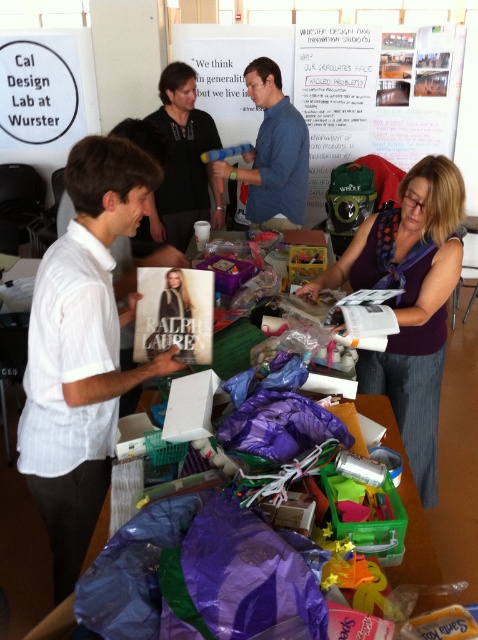
Question: Does blue cotton shirt at center have a greater width compared to black shirt at center?

Choices:
 (A) no
 (B) yes

Answer: (B)

Question: Which object is positioned closest to the whiteboard at upper center?

Choices:
 (A) purple fabric at center
 (B) purple plastic bag at center
 (C) white striped shirt at left
 (D) blue cotton shirt at center

Answer: (D)

Question: Which point is closer to the camera?

Choices:
 (A) (228, 138)
 (B) (137, 432)
 (C) (171, 188)

Answer: (B)

Question: Which object is the closest to the blue cotton shirt at center?

Choices:
 (A) purple fabric at center
 (B) white striped shirt at left
 (C) whiteboard at upper center

Answer: (C)

Question: Is the position of whiteboard at upper center less distant than that of purple plastic bag at center?

Choices:
 (A) yes
 (B) no

Answer: (B)

Question: Does white striped shirt at left have a greater width compared to blue cotton shirt at center?

Choices:
 (A) no
 (B) yes

Answer: (A)